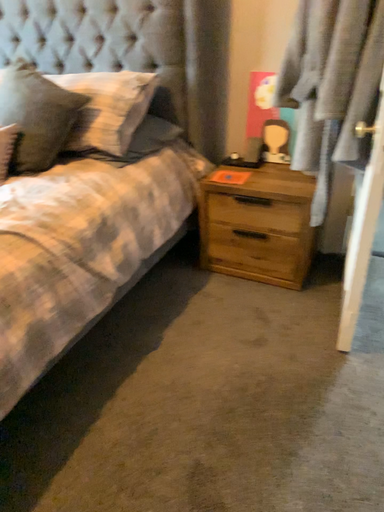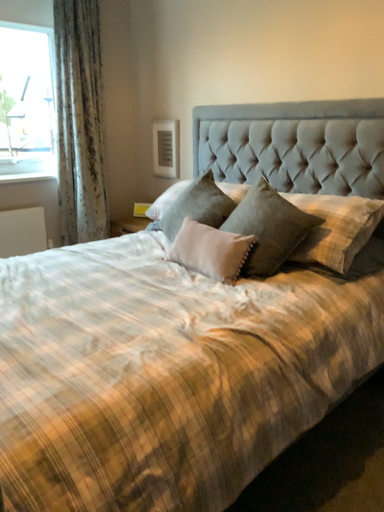
Question: How did the camera likely rotate when shooting the video?

Choices:
 (A) rotated left
 (B) rotated right

Answer: (A)